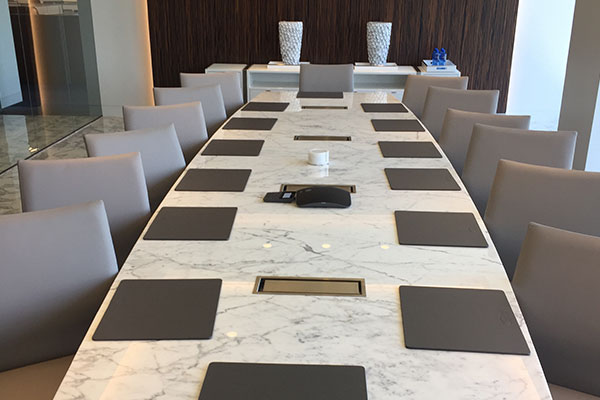
Identify the location of black speaker. (317, 192).